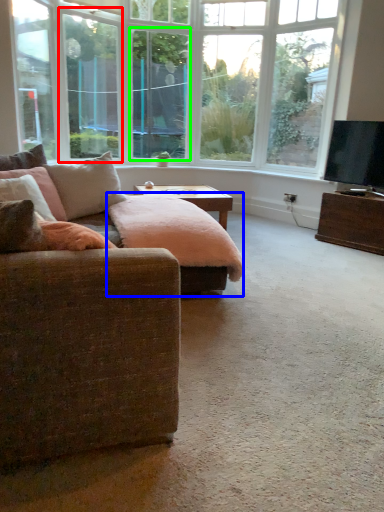
Question: Based on their relative distances, which object is nearer to window screen (highlighted by a red box)? Choose from swivel chair (highlighted by a blue box) and window screen (highlighted by a green box).

Choices:
 (A) swivel chair
 (B) window screen

Answer: (B)